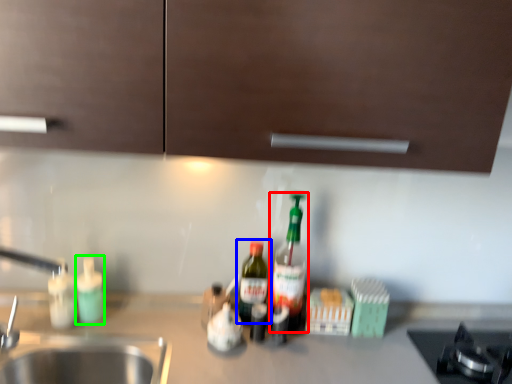
Question: Which is farther away from bottle (highlighted by a red box)? bottle (highlighted by a blue box) or bottle (highlighted by a green box)?

Choices:
 (A) bottle
 (B) bottle

Answer: (B)